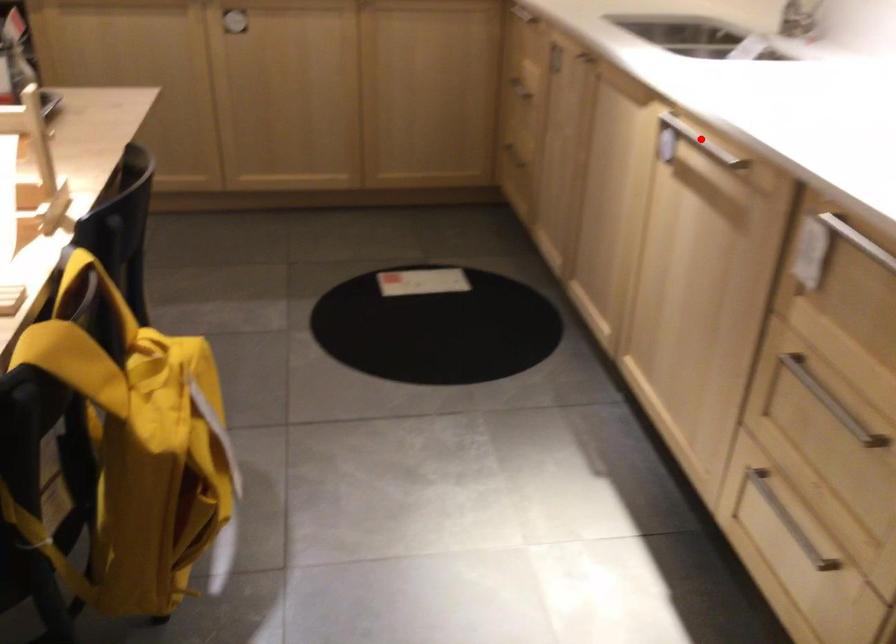
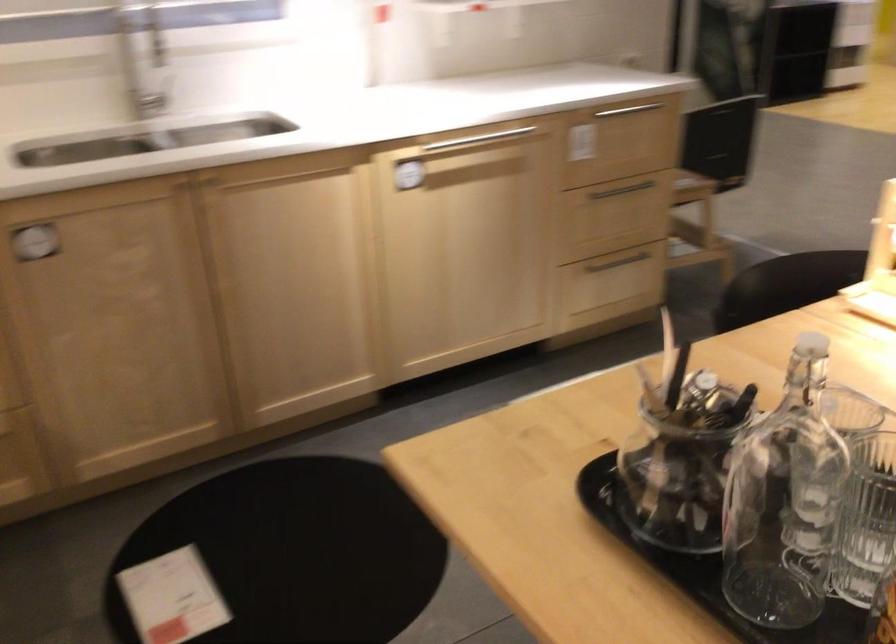
Question: I am providing you with two images of the same scene from different viewpoints. A red point is shown in image1. For the corresponding object point in image2, is it positioned nearer or farther from the camera?

Choices:
 (A) Nearer
 (B) Farther

Answer: (B)